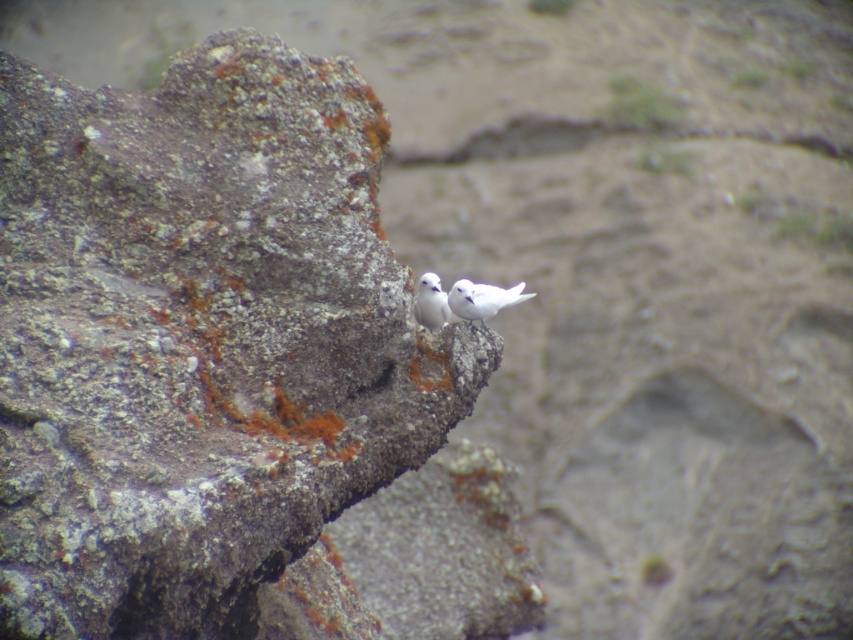
Question: Which of the following is the closest to the observer?

Choices:
 (A) (434, 326)
 (B) (465, 280)

Answer: (B)

Question: Can you confirm if rusty stone boulder at center is smaller than white feathered bird at center?

Choices:
 (A) no
 (B) yes

Answer: (A)

Question: Which point is farther from the camera taking this photo?

Choices:
 (A) (99, 307)
 (B) (502, 298)
 (C) (436, 292)

Answer: (B)

Question: Which object appears farthest from the camera in this image?

Choices:
 (A) rusty stone boulder at center
 (B) white matte bird at center
 (C) white feathered bird at center

Answer: (B)

Question: Does rusty stone boulder at center appear on the right side of white matte bird at center?

Choices:
 (A) no
 (B) yes

Answer: (A)

Question: Considering the relative positions of white matte bird at center and white feathered bird at center in the image provided, where is white matte bird at center located with respect to white feathered bird at center?

Choices:
 (A) left
 (B) right

Answer: (B)